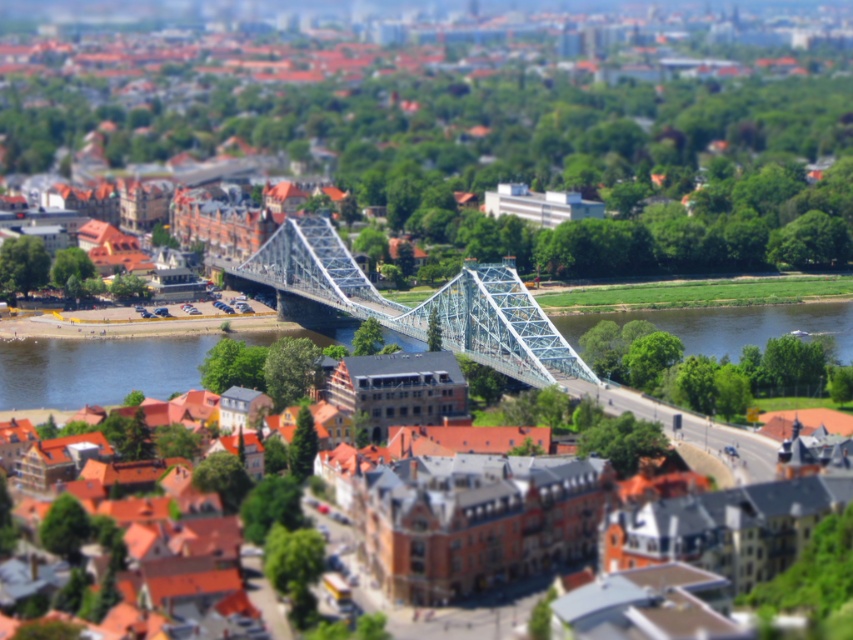
Question: Is blue metallic river at center to the left of blue metallic bridge at center from the viewer's perspective?

Choices:
 (A) yes
 (B) no

Answer: (B)

Question: Is blue metallic river at center positioned at the back of blue metallic bridge at center?

Choices:
 (A) yes
 (B) no

Answer: (A)

Question: Which object is closer to the camera taking this photo?

Choices:
 (A) blue metallic bridge at center
 (B) blue metallic river at center

Answer: (A)

Question: Which point is closer to the camera?

Choices:
 (A) blue metallic river at center
 (B) blue metallic bridge at center

Answer: (B)

Question: Which object is farther from the camera taking this photo?

Choices:
 (A) blue metallic bridge at center
 (B) blue metallic river at center

Answer: (B)

Question: Does blue metallic river at center have a greater width compared to blue metallic bridge at center?

Choices:
 (A) no
 (B) yes

Answer: (B)